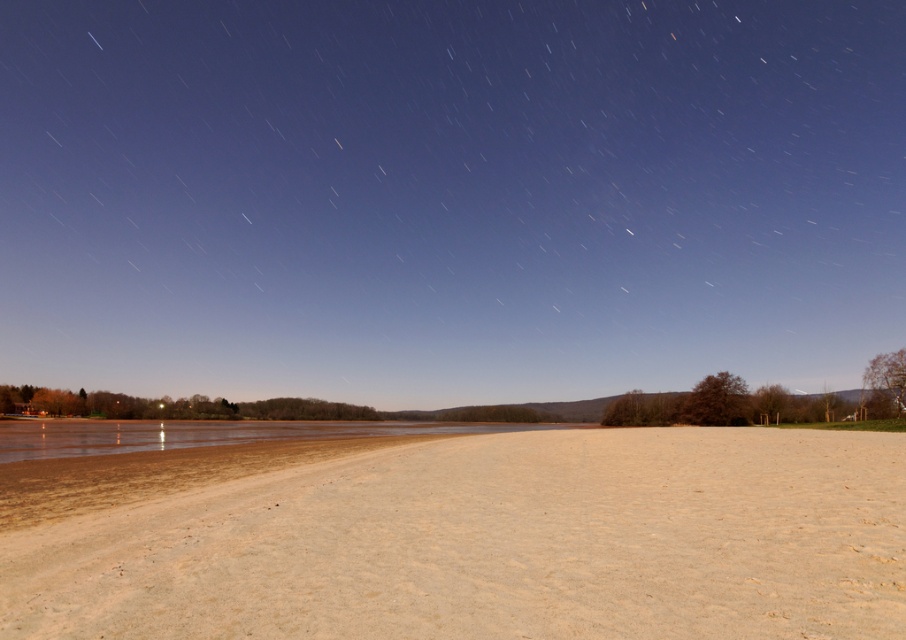
You are standing on the sandy beige dirt field at lower center and want to walk towards the smooth sand at lower center. Which direction should you move to reach it?

The smooth sand at lower center is taller than the sandy beige dirt field at lower center, so you should move upward to reach it.

Based on the photo, you are standing on the light beige sand in the foreground of the scene. There is a point marked at coordinate (448, 195). What is the texture of the ground at that location?

The point at coordinate (448, 195) indicates smooth sand at lower center, so the texture there is smooth.

You are standing at the edge of the sandy beige dirt field at lower center and want to walk towards the smooth sand at lower center. Which direction should you move to reach it?

The smooth sand at lower center is located above the sandy beige dirt field at lower center, so you should move upward to reach it.